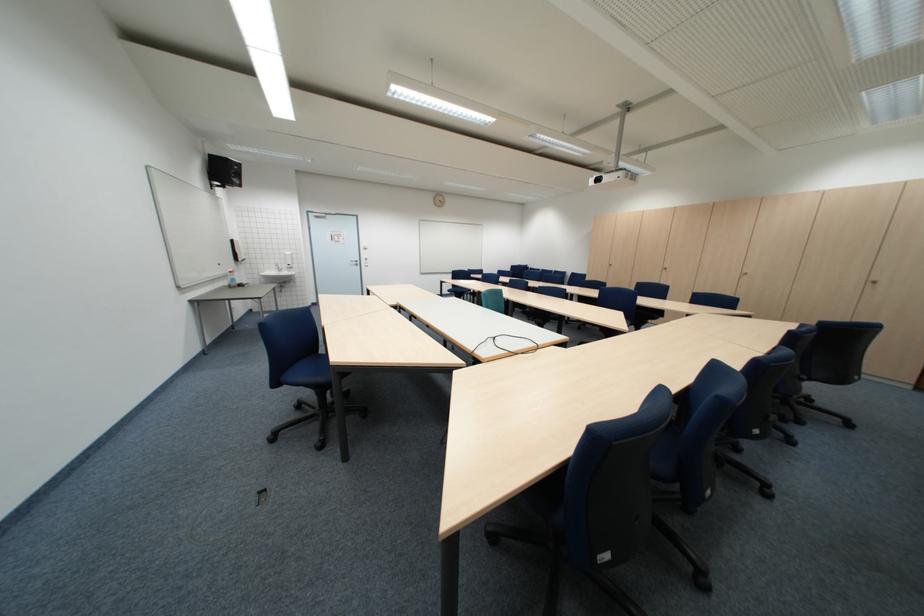
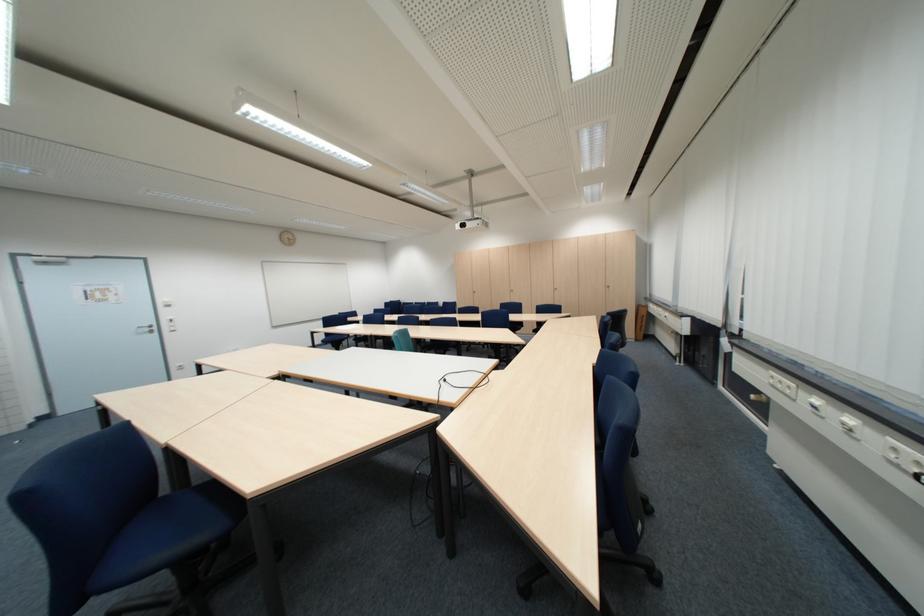
Locate, in the second image, the point that corresponds to (334,353) in the first image.

(177, 492)